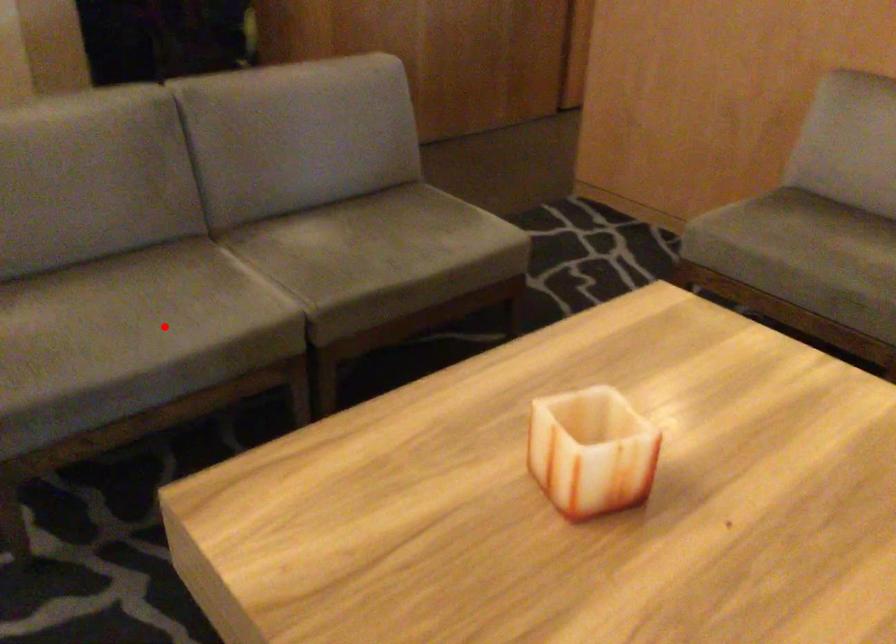
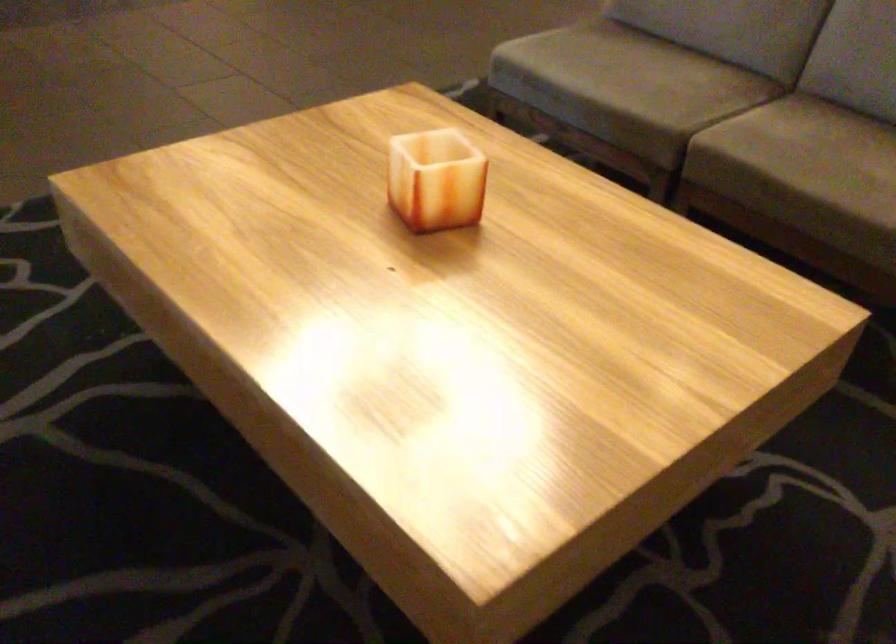
Question: I am providing you with two images of the same scene from different viewpoints. Image1 has a red point marked. In image2, the corresponding 3D location appears at what relative position? Reply with the corresponding letter.

Choices:
 (A) Closer
 (B) Farther

Answer: (B)